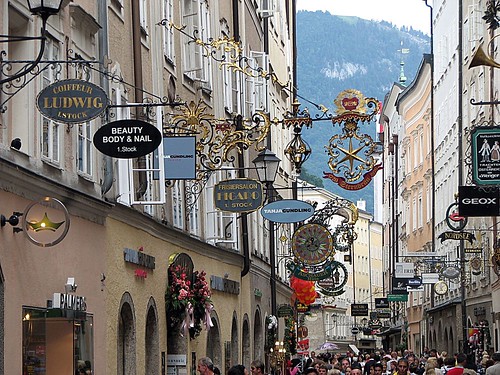
I want to click on open windows, so (161, 177), (233, 227), (219, 229), (262, 92), (237, 96).